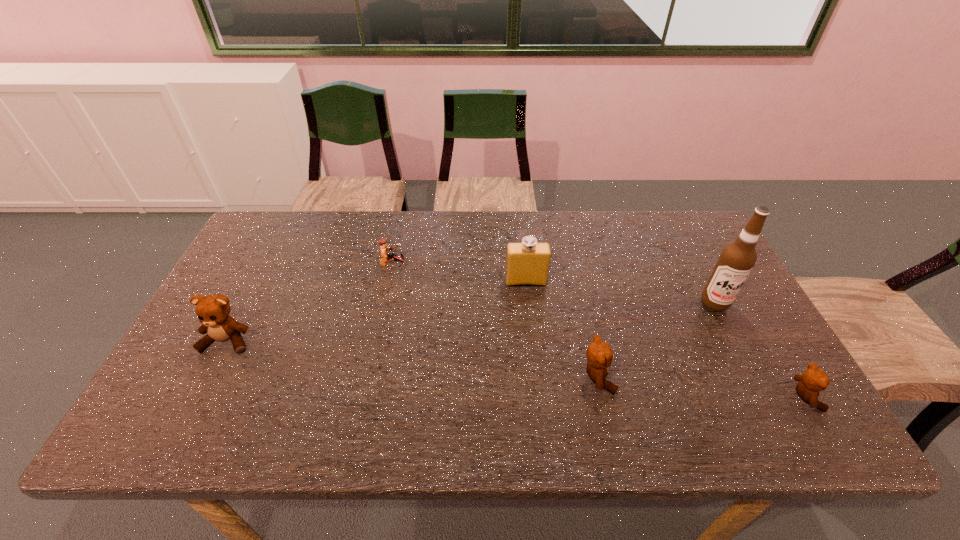
Locate an element on the screen. Image resolution: width=960 pixels, height=540 pixels. vacant position for inserting another teddy_bear evenly is located at coordinates (406, 359).